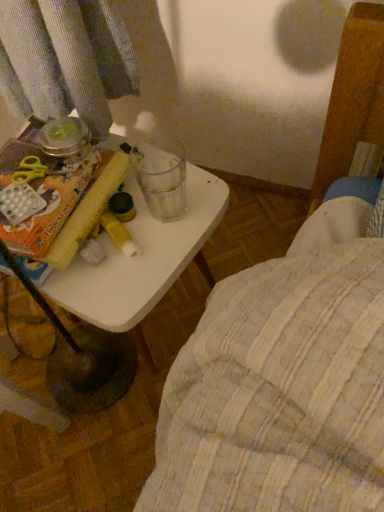
Question: From a real-world perspective, is yellow paper at left positioned above or below white plastic table at center?

Choices:
 (A) below
 (B) above

Answer: (B)

Question: Based on their positions, is yellow paper at left located to the left or right of white plastic table at center?

Choices:
 (A) right
 (B) left

Answer: (B)

Question: Looking at their shapes, would you say yellow paper at left is wider or thinner than white plastic table at center?

Choices:
 (A) wide
 (B) thin

Answer: (B)

Question: Looking at the image, does white plastic table at center seem bigger or smaller compared to yellow paper at left?

Choices:
 (A) big
 (B) small

Answer: (A)

Question: Is white plastic table at center in front of or behind yellow paper at left in the image?

Choices:
 (A) front
 (B) behind

Answer: (B)

Question: In terms of height, does white plastic table at center look taller or shorter compared to yellow paper at left?

Choices:
 (A) short
 (B) tall

Answer: (B)

Question: From the image's perspective, relative to yellow paper at left, is white plastic table at center above or below?

Choices:
 (A) below
 (B) above

Answer: (A)